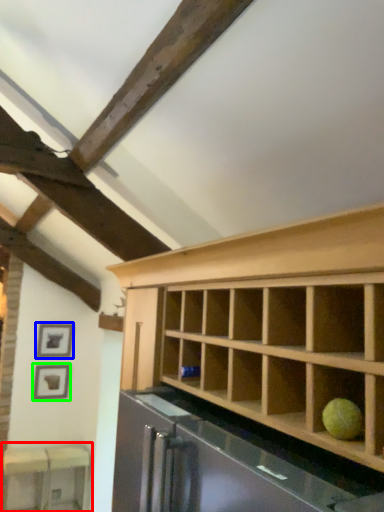
Question: Which is farther away from table (highlighted by a red box)? picture frame (highlighted by a blue box) or picture frame (highlighted by a green box)?

Choices:
 (A) picture frame
 (B) picture frame

Answer: (A)